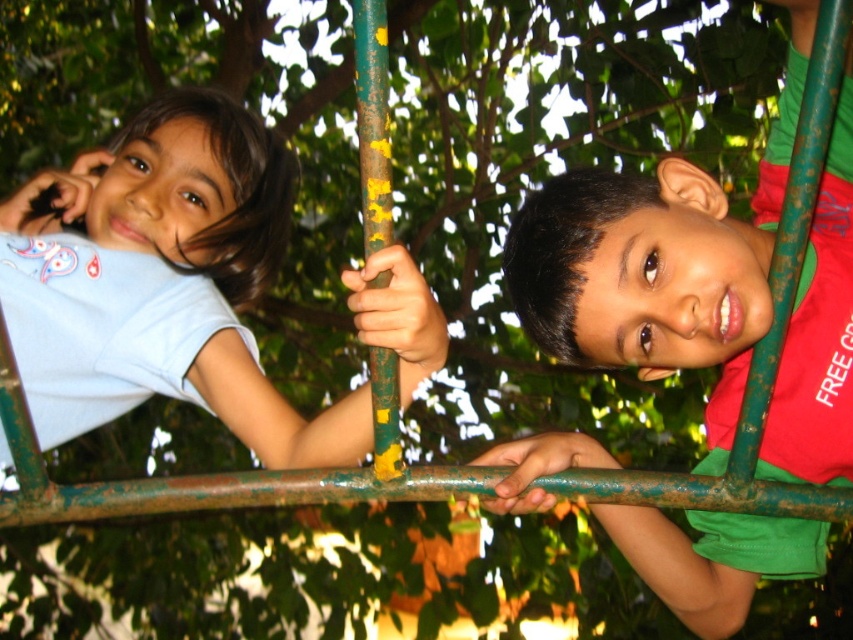
You are a photographer trying to capture both children in a single photo. Since the matte blue shirt at left and the green matte shirt at center are positioned differently, which child should you focus on first to ensure both are in the frame?

You should focus on the matte blue shirt at left first because it is in front of the green matte shirt at center, ensuring both will be visible in the photo.

Where is the green matte shirt at center located in the image?

The green matte shirt at center is located at point 0.431 on the x axis and 0.758 on the y axis.